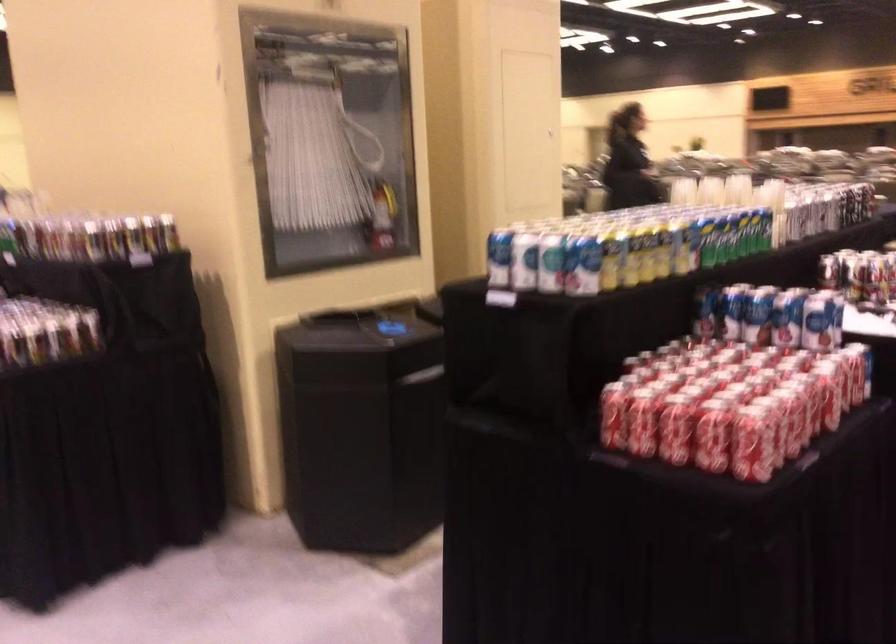
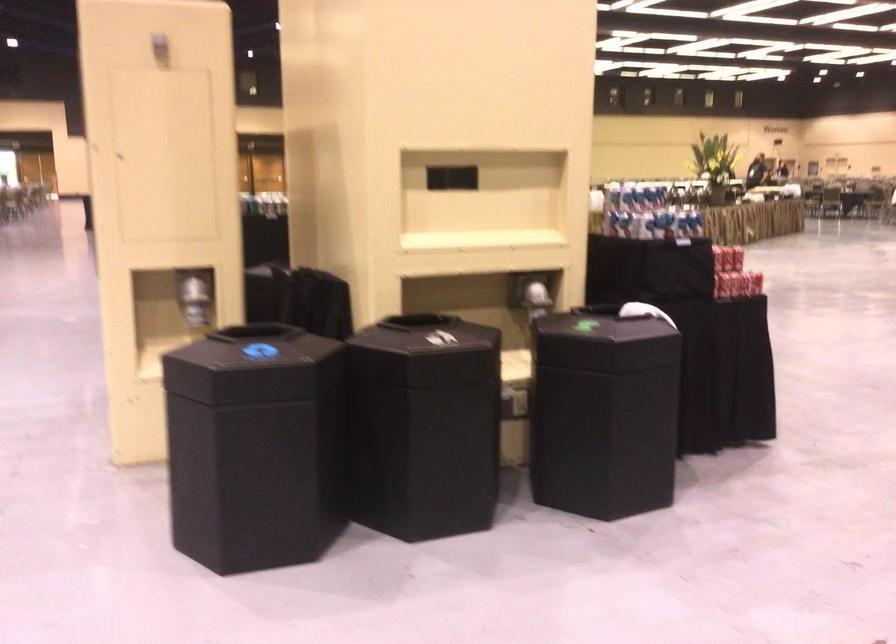
Question: I am providing you with two images of the same scene from different viewpoints. Please identify which objects are invisible in image2.

Choices:
 (A) grey storage box
 (B) black bin lid
 (C) blue and white can
 (D) shiny dispenser lever

Answer: (C)